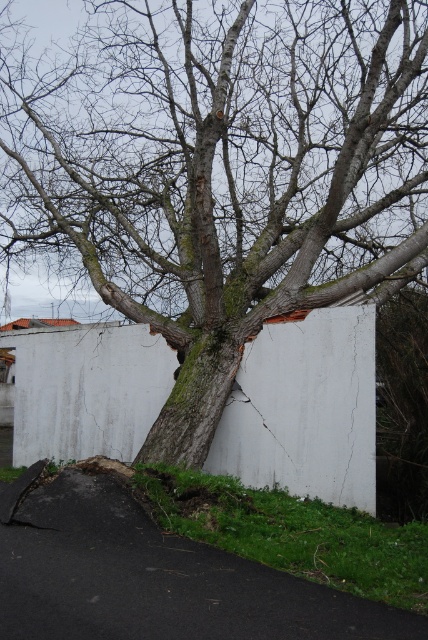
You are a construction worker assessing the stability of the white concrete wall at center. You notice the green rough bark tree at center nearby. Based on their positions, what potential issue might the tree cause to the wall?

The green rough bark tree at center is located above the white concrete wall at center, so its roots might be growing into the wall, causing structural damage.

You are standing in front of the green rough bark tree at center and the white concrete wall at center. Which object is nearer to you?

The green rough bark tree at center is closer to the viewer than the white concrete wall at center, so the green rough bark tree at center is nearer to you.